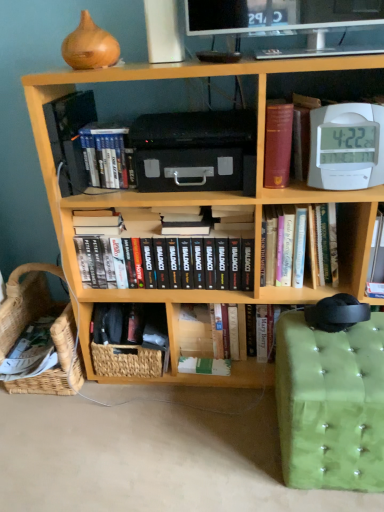
Question: Is green tufted fabric swivel chair at lower right situated inside woven basket at lower left, acting as the 1th basket starting from the right, or outside?

Choices:
 (A) inside
 (B) outside

Answer: (B)

Question: In terms of width, does green tufted fabric swivel chair at lower right look wider or thinner when compared to woven basket at lower left, acting as the 1th basket starting from the right?

Choices:
 (A) thin
 (B) wide

Answer: (B)

Question: Which object is the closest to the leather-bound book at upper right, positioned as the first paperback book in top-to-bottom order?

Choices:
 (A) wooden bookcase at center
 (B) white plastic clock at upper right, acting as the first book starting from the right
 (C) woven natural basket at lower left, the 2th basket in the right-to-left sequence
 (D) woven basket at lower left, the second basket viewed from the left
 (E) hardcover books at center left, positioned as the 1th book in left-to-right order

Answer: (B)

Question: Which is nearer to the woven basket at lower left, acting as the 1th basket starting from the right?

Choices:
 (A) woven natural basket at lower left, which ranks as the first basket in left-to-right order
 (B) hardcover books at center, which ranks as the 2th book in left-to-right order
 (C) white plastic clock at upper right, the fourth book from the left
 (D) leather-bound book at upper right, placed as the third paperback book when sorted from back to front
 (E) hardcover books at center left, the 4th book when ordered from right to left

Answer: (A)